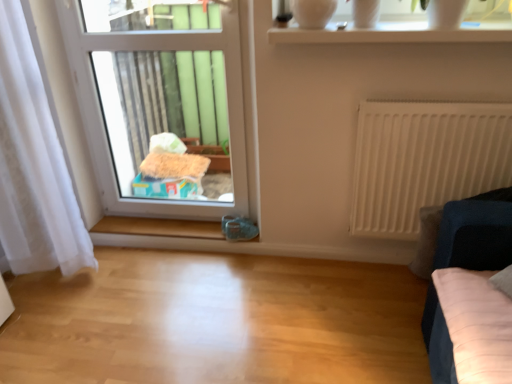
Question: Is transparent plastic window at center, the 1th window from the back, taller or shorter than transparent glass vase at upper center?

Choices:
 (A) short
 (B) tall

Answer: (B)

Question: Is transparent plastic window at center, arranged as the 2th window when viewed from the right, in front of or behind transparent glass vase at upper center in the image?

Choices:
 (A) behind
 (B) front

Answer: (A)

Question: Considering the real-world distances, which object is farthest from the white glossy vase at upper center, the second window when ordered from back to front?

Choices:
 (A) velvet dark blue sofa at right
 (B) white sheer curtain at left
 (C) transparent plastic window at center, arranged as the 2th window when viewed from the right
 (D) transparent glass vase at upper center
 (E) white matte radiator at right

Answer: (B)

Question: Considering the real-world distances, which object is closest to the white sheer curtain at left?

Choices:
 (A) white matte radiator at right
 (B) transparent glass vase at upper center
 (C) velvet dark blue sofa at right
 (D) transparent plastic window at center, the 1th window from the back
 (E) white glossy vase at upper center, which ranks as the first window in front-to-back order

Answer: (D)